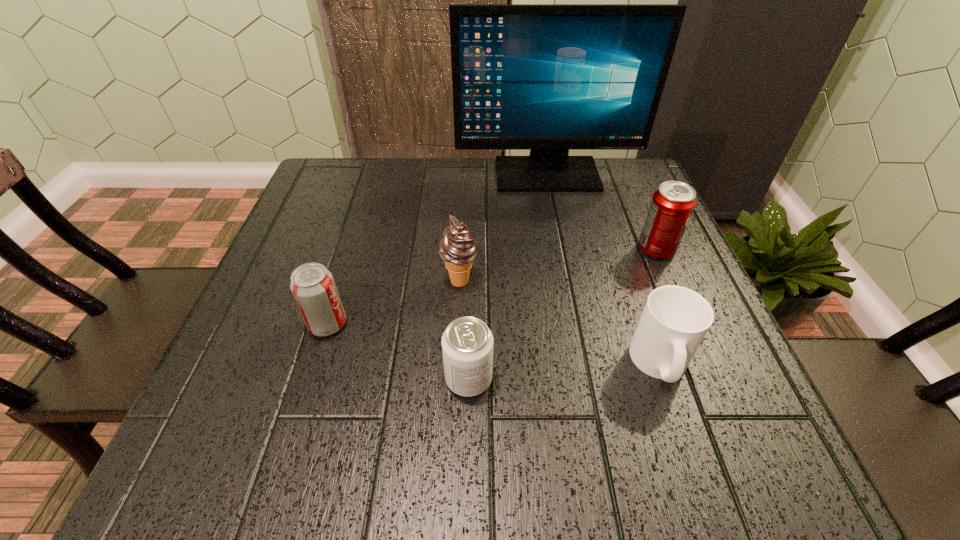
At what (x,y) coordinates should I click in order to perform the action: click on vacant area that lies between the leftmost object and the second soda can from right to left. Please return your answer as a coordinate pair (x, y). Image resolution: width=960 pixels, height=540 pixels. Looking at the image, I should click on (398, 352).

At what (x,y) coordinates should I click in order to perform the action: click on vacant space that is in between the icecream and the second farthest object. Please return your answer as a coordinate pair (x, y). Looking at the image, I should click on (558, 265).

What are the coordinates of `unoccupied area between the icecream and the farthest object` in the screenshot? It's located at (503, 228).

Locate an element on the screen. This screenshot has height=540, width=960. blank region between the mug and the monitor is located at coordinates (604, 269).

This screenshot has height=540, width=960. What are the coordinates of `vacant point located between the fifth nearest object and the nearest soda can` in the screenshot? It's located at (563, 314).

Where is `object that stands as the closest to the rightmost soda can`? The image size is (960, 540). object that stands as the closest to the rightmost soda can is located at coordinates (548, 78).

Locate an element on the screen. Image resolution: width=960 pixels, height=540 pixels. object that is the third closest one to the mug is located at coordinates (458, 249).

Locate which soda can is the third closest to the fourth nearest object. Please provide its 2D coordinates. Your answer should be formatted as a tuple, i.e. [(x, y)], where the tuple contains the x and y coordinates of a point satisfying the conditions above.

[(672, 204)]

Point out which soda can is positioned as the second nearest to the mug. Please provide its 2D coordinates. Your answer should be formatted as a tuple, i.e. [(x, y)], where the tuple contains the x and y coordinates of a point satisfying the conditions above.

[(467, 343)]

Identify the location of free space in the image that satisfies the following two spatial constraints: 1. on the screen side of the fifth nearest object; 2. on the right side of the farthest object. (562, 249).